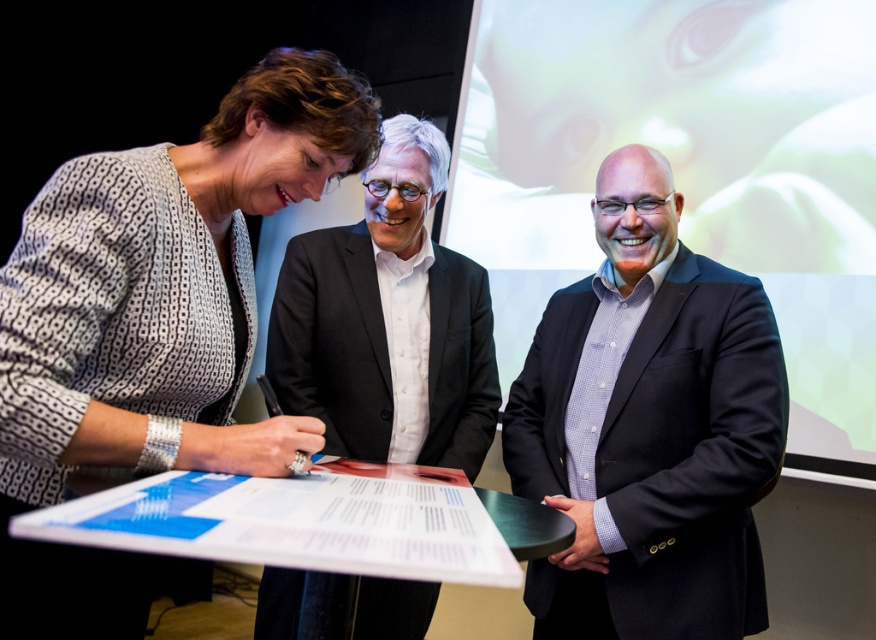
Which of these two, patterned fabric dress at left or matte black suit at center, stands shorter?

matte black suit at center

Does patterned fabric dress at left have a lesser width compared to matte black suit at center?

Indeed, patterned fabric dress at left has a lesser width compared to matte black suit at center.

What do you see at coordinates (152, 324) in the screenshot? Image resolution: width=876 pixels, height=640 pixels. I see `patterned fabric dress at left` at bounding box center [152, 324].

This screenshot has height=640, width=876. I want to click on patterned fabric dress at left, so point(152,324).

In the scene shown: Which of these two, black suit at center or matte black suit at center, stands shorter?

matte black suit at center

Is the position of black suit at center more distant than that of matte black suit at center?

No, black suit at center is in front of matte black suit at center.

In order to click on black suit at center in this screenshot , I will do `click(648, 428)`.

This screenshot has height=640, width=876. In order to click on black suit at center in this screenshot , I will do `click(648, 428)`.

Does point (81, 572) come farther from viewer compared to point (641, 205)?

No, it is in front of (641, 205).

Between point (13, 628) and point (634, 269), which one is positioned in front?

Point (13, 628) is in front.

This screenshot has width=876, height=640. Identify the location of patterned fabric dress at left. (152, 324).